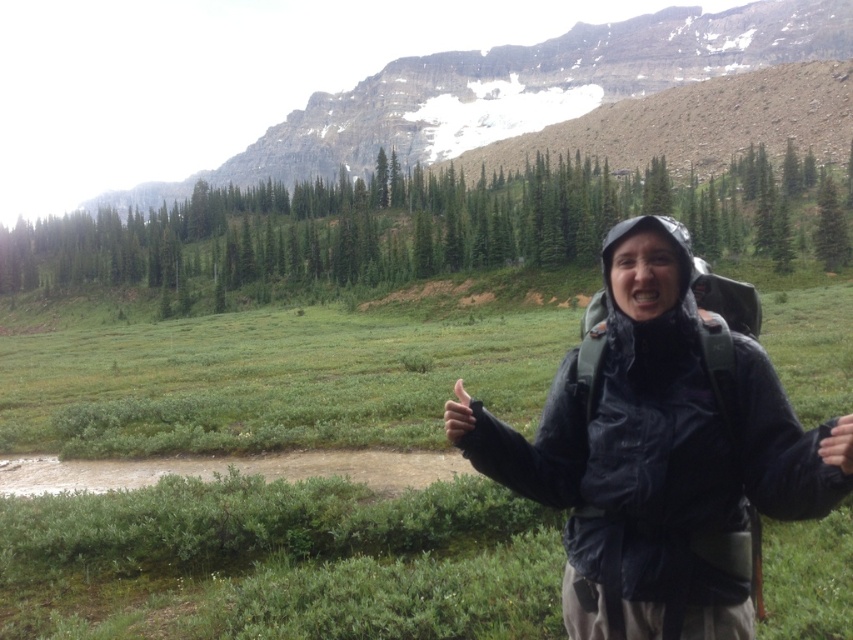
Question: Where is matte black jacket at center located in relation to green grassy mountain at upper center in the image?

Choices:
 (A) left
 (B) right

Answer: (B)

Question: Which point is closer to the camera?

Choices:
 (A) (450, 122)
 (B) (550, 474)

Answer: (B)

Question: Is matte black jacket at center to the left of green grassy mountain at upper center from the viewer's perspective?

Choices:
 (A) yes
 (B) no

Answer: (B)

Question: Which point is closer to the camera taking this photo?

Choices:
 (A) click(x=340, y=163)
 (B) click(x=689, y=339)

Answer: (B)

Question: Is matte black jacket at center positioned in front of green grassy mountain at upper center?

Choices:
 (A) no
 (B) yes

Answer: (B)